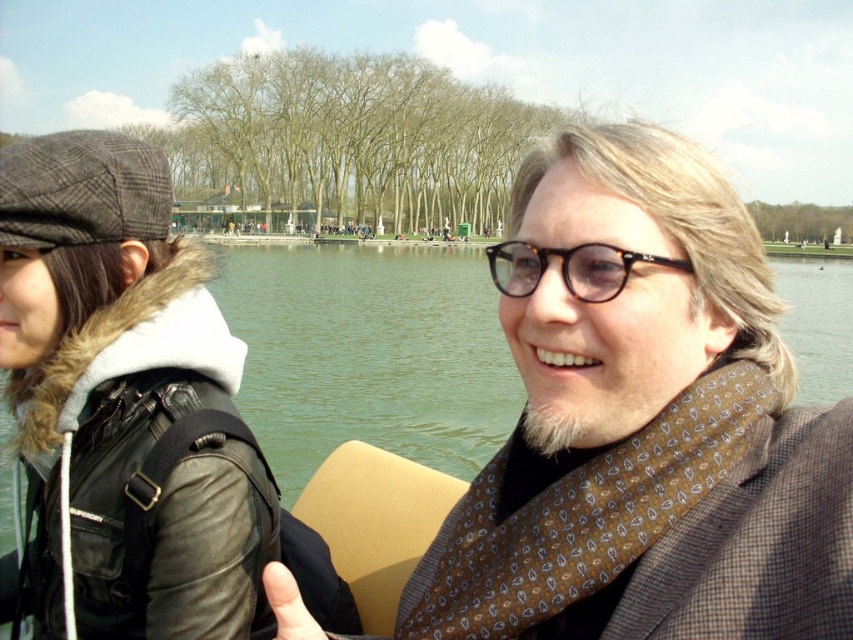
You are a photographer trying to capture a clear photo of the tortoiseshell frame glasses at center. However, the matte black jacket at left is blocking your view. Can you move the jacket to get a clear shot?

The matte black jacket at left is in front of the tortoiseshell frame glasses at center, so moving the jacket would allow you to see the glasses clearly.